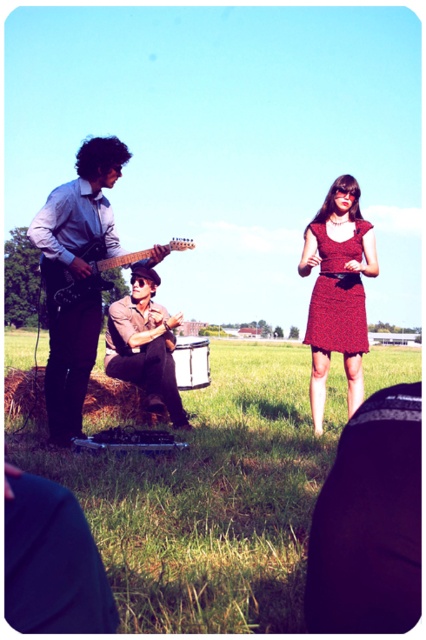
You are a photographer positioned at the back of the field. You want to take a photo of the brown leather jacket at center and the metallic drum at center. Which object will appear larger in your photo?

The brown leather jacket at center will appear larger in the photo because it is closer to the viewer than the metallic drum at center.

You are a photographer at a fashion show. You need to position two models wearing the matte red dress at center and the red textured dress at center so that both dresses are visible in the photo. Which dress should you place closer to the camera to ensure the shorter dress is fully visible?

The red textured dress at center is shorter than the matte red dress at center. To ensure the shorter dress is fully visible, place the red textured dress at center closer to the camera.